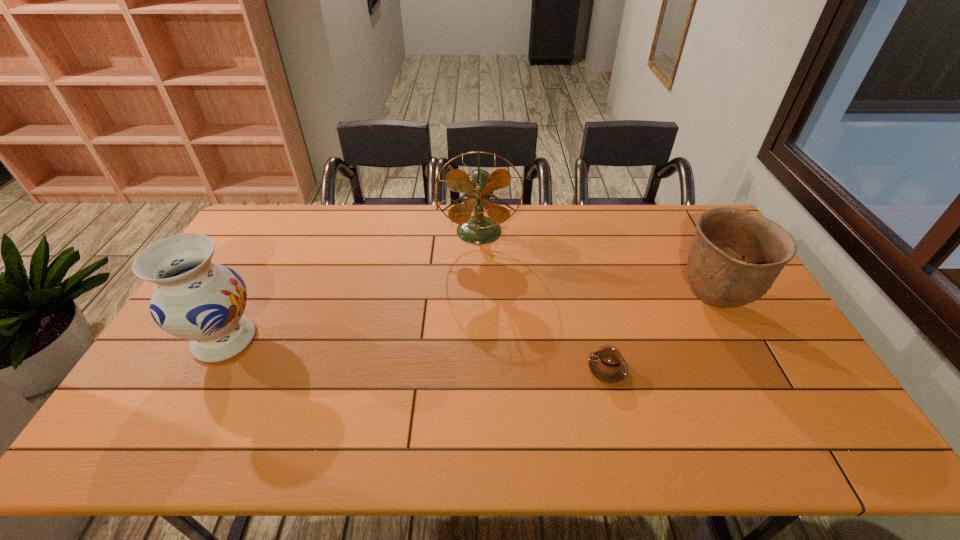
In order to click on free space located 0.110m on the side of the cappuccino with the handle in this screenshot , I will do `click(546, 370)`.

Find the location of `vacant space situated 0.100m on the side of the cappuccino with the handle`. vacant space situated 0.100m on the side of the cappuccino with the handle is located at coordinates (550, 370).

You are a GUI agent. You are given a task and a screenshot of the screen. Output one action in this format:
    pyautogui.click(x=<x>, y=<y>)
    Task: Click on the vacant region located 0.260m on the side of the cappuccino with the handle
    
    Given the screenshot: What is the action you would take?
    pyautogui.click(x=490, y=370)

Where is `object located at the far edge`? object located at the far edge is located at coordinates (478, 185).

At what (x,y) coordinates should I click in order to perform the action: click on object at the left edge. Please return your answer as a coordinate pair (x, y). The image size is (960, 540). Looking at the image, I should click on (195, 299).

Where is `object positioned at the right edge`? The height and width of the screenshot is (540, 960). object positioned at the right edge is located at coordinates (735, 256).

At what (x,y) coordinates should I click in order to perform the action: click on vacant region at the far edge. Please return your answer as a coordinate pair (x, y). Looking at the image, I should click on (407, 238).

Locate an element on the screen. free region at the near edge is located at coordinates (233, 422).

Locate an element on the screen. vacant space at the left edge of the desktop is located at coordinates (180, 386).

Locate an element on the screen. vacant region at the far left corner of the desktop is located at coordinates (289, 210).